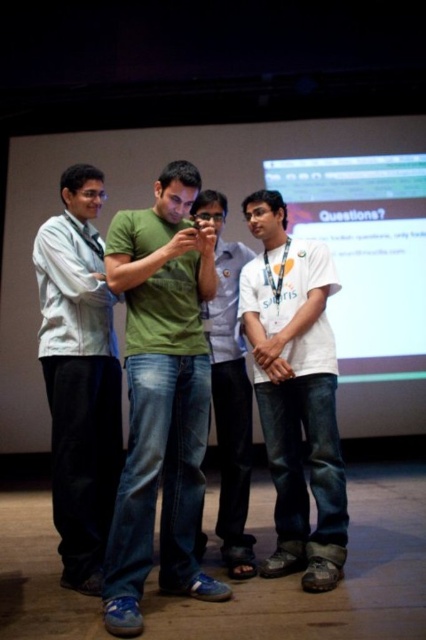
Question: Which point appears closest to the camera in this image?

Choices:
 (A) (281, 346)
 (B) (118, 161)
 (C) (219, 310)
 (D) (178, 506)

Answer: (D)

Question: Is light gray shirt at left wider than green denim jeans at center?

Choices:
 (A) no
 (B) yes

Answer: (B)

Question: Is white matte projection screen at upper center to the left of green denim jeans at center from the viewer's perspective?

Choices:
 (A) no
 (B) yes

Answer: (B)

Question: Among these objects, which one is nearest to the camera?

Choices:
 (A) white cotton shirt at center
 (B) green matte t-shirt at center
 (C) light gray shirt at left
 (D) white matte projection screen at upper center

Answer: (B)

Question: Among these points, which one is nearest to the camera?

Choices:
 (A) (74, 305)
 (B) (170, 285)

Answer: (B)

Question: Does white matte projection screen at upper center come in front of green matte t-shirt at center?

Choices:
 (A) no
 (B) yes

Answer: (A)